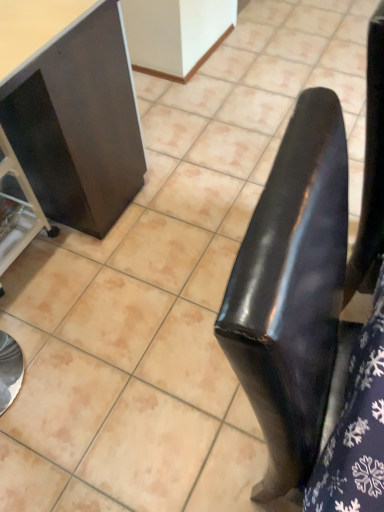
Identify the location of vacant point to the right of metallic silver cart at left, the 2th furniture when ordered from right to left. This screenshot has width=384, height=512. (86, 262).